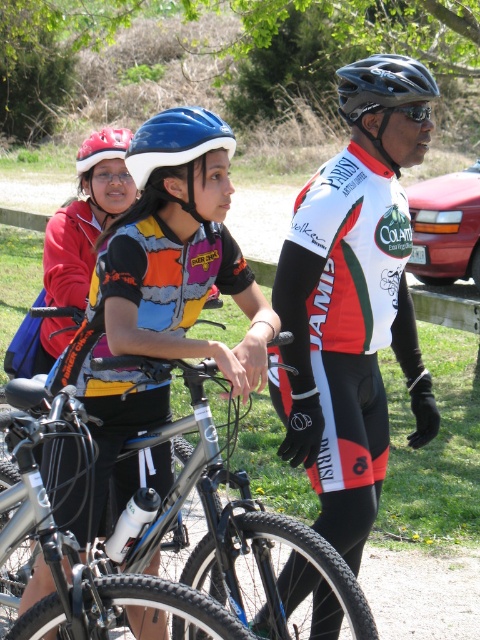
You are planning to carry both the silver metallic bicycle at center and the shiny black helmet at center in a car trunk that can only accommodate items narrower than the helmet. Will both items fit?

The silver metallic bicycle at center is narrower than the shiny black helmet at center. Since the trunk can only accommodate items narrower than the helmet, the bicycle will fit, but the helmet itself will not. Therefore, only the bicycle can be placed in the trunk.

Based on the coordinates provided, which object is located at point [352,301]?

The white red black cycling suit at center is located at point [352,301].